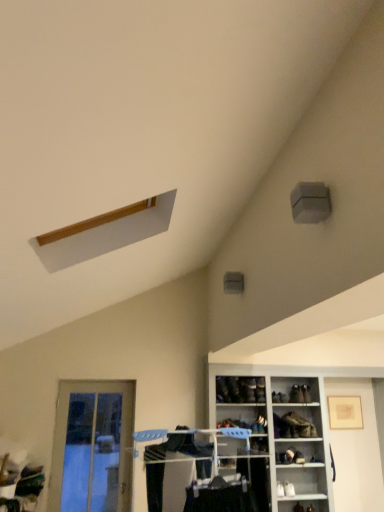
Describe the element at coordinates (249, 389) in the screenshot. I see `leather shoe at center, the 3th shoe from the right` at that location.

Measure the distance between point (300, 445) and camera.

Point (300, 445) is 5.01 meters from camera.

This screenshot has height=512, width=384. I want to click on white glossy shoe rack at lower right, the second shelf positioned from the left, so click(x=278, y=434).

This screenshot has height=512, width=384. I want to click on matte black shoe at lower center, arranged as the second shelf when viewed from the right, so click(293, 426).

Measure the distance between point (59, 412) and camera.

They are 15.10 feet apart.

At what (x,y) coordinates should I click in order to perform the action: click on leather shoe at center, acting as the second shoe starting from the right. Please return your answer as a coordinate pair (x, y). The width and height of the screenshot is (384, 512). Looking at the image, I should click on (260, 390).

From the image's perspective, is leather shoe at lower center, which is the 1th shoe from right to left, located above matte black shoe at lower center, positioned as the 1th shelf in left-to-right order?

Yes, from the image's perspective, leather shoe at lower center, which is the 1th shoe from right to left, is on top of matte black shoe at lower center, positioned as the 1th shelf in left-to-right order.

Is leather shoe at lower center, which is the 1th shoe from right to left, facing away from matte black shoe at lower center, positioned as the 1th shelf in left-to-right order?

leather shoe at lower center, which is the 1th shoe from right to left, is not turned away from matte black shoe at lower center, positioned as the 1th shelf in left-to-right order.

Is leather shoe at lower center, which is the 1th shoe from right to left, shorter than matte black shoe at lower center, positioned as the 1th shelf in left-to-right order?

Correct, leather shoe at lower center, which is the 1th shoe from right to left, is not as tall as matte black shoe at lower center, positioned as the 1th shelf in left-to-right order.

Can you confirm if leather shoe at lower center, the fourth shoe from the left, is smaller than matte black shoe at lower center, arranged as the second shelf when viewed from the right?

Indeed, leather shoe at lower center, the fourth shoe from the left, has a smaller size compared to matte black shoe at lower center, arranged as the second shelf when viewed from the right.

Looking at this image, is leather shoe at lower center, which is the 1th shoe from right to left, turned away from leather shoe at center, acting as the second shoe starting from the right?

No, leather shoe at lower center, which is the 1th shoe from right to left,'s orientation is not away from leather shoe at center, acting as the second shoe starting from the right.

From a real-world perspective, who is located higher, leather shoe at lower center, which is the 1th shoe from right to left, or leather shoe at center, acting as the second shoe starting from the right?

leather shoe at center, acting as the second shoe starting from the right.

Is leather shoe at lower center, the fourth shoe from the left, inside or outside of leather shoe at center, which is counted as the 3th shoe, starting from the left?

leather shoe at lower center, the fourth shoe from the left, lies outside leather shoe at center, which is counted as the 3th shoe, starting from the left.

How much distance is there between leather shoe at lower center, which is the 1th shoe from right to left, and leather shoe at center, which is counted as the 3th shoe, starting from the left?

They are 30.85 inches apart.

Are matte plastic clothes rack at lower center and leather shoe at lower center, the fourth shoe from the left, located far from each other?

Yes, matte plastic clothes rack at lower center and leather shoe at lower center, the fourth shoe from the left, are located far from each other.

In the image, there is a leather shoe at lower center, the fourth shoe from the left. Where is `closet below it (from a real-world perspective)`? closet below it (from a real-world perspective) is located at coordinates (204, 471).

From the image's perspective, relative to leather shoe at lower center, the fourth shoe from the left, is matte plastic clothes rack at lower center above or below?

From the image's perspective, matte plastic clothes rack at lower center appears above leather shoe at lower center, the fourth shoe from the left.

Is matte plastic clothes rack at lower center wider or thinner than leather shoe at lower center, the fourth shoe from the left?

Considering their sizes, matte plastic clothes rack at lower center looks broader than leather shoe at lower center, the fourth shoe from the left.

From the image's perspective, relative to matte plastic clothes rack at lower center, is matte black shoe at lower center, positioned as the 1th shelf in left-to-right order, above or below?

matte black shoe at lower center, positioned as the 1th shelf in left-to-right order, is below matte plastic clothes rack at lower center.

Can you confirm if matte black shoe at lower center, arranged as the second shelf when viewed from the right, is positioned to the right of matte plastic clothes rack at lower center?

Yes.

Is matte black shoe at lower center, positioned as the 1th shelf in left-to-right order, looking in the opposite direction of matte plastic clothes rack at lower center?

No, matte plastic clothes rack at lower center is not at the back of matte black shoe at lower center, positioned as the 1th shelf in left-to-right order.

Considering the relative sizes of white glossy shoe rack at lower right, the 1th shelf when ordered from right to left, and leather shoe at lower center, the fourth shoe from the left, in the image provided, is white glossy shoe rack at lower right, the 1th shelf when ordered from right to left, bigger than leather shoe at lower center, the fourth shoe from the left,?

Indeed, white glossy shoe rack at lower right, the 1th shelf when ordered from right to left, has a larger size compared to leather shoe at lower center, the fourth shoe from the left.

From the picture: Could you tell me if white glossy shoe rack at lower right, the second shelf positioned from the left, is facing leather shoe at lower center, which is the 1th shoe from right to left?

Yes.

From the image's perspective, is white glossy shoe rack at lower right, the 1th shelf when ordered from right to left, located above or below leather shoe at lower center, which is the 1th shoe from right to left?

white glossy shoe rack at lower right, the 1th shelf when ordered from right to left, is below leather shoe at lower center, which is the 1th shoe from right to left.

Which object is closer to the camera, leather shoe at center, acting as the second shoe starting from the right, or matte black shoe at lower center, positioned as the 1th shelf in left-to-right order?

matte black shoe at lower center, positioned as the 1th shelf in left-to-right order, is in front.

Which of these two, leather shoe at center, acting as the second shoe starting from the right, or matte black shoe at lower center, positioned as the 1th shelf in left-to-right order, stands shorter?

With less height is matte black shoe at lower center, positioned as the 1th shelf in left-to-right order.

How different are the orientations of leather shoe at center, which is counted as the 3th shoe, starting from the left, and matte black shoe at lower center, arranged as the second shelf when viewed from the right, in degrees?

6.28 degrees separate the facing orientations of leather shoe at center, which is counted as the 3th shoe, starting from the left, and matte black shoe at lower center, arranged as the second shelf when viewed from the right.

Is leather shoe at center, which is counted as the 3th shoe, starting from the left, smaller than matte black shoe at lower center, positioned as the 1th shelf in left-to-right order?

Correct, leather shoe at center, which is counted as the 3th shoe, starting from the left, occupies less space than matte black shoe at lower center, positioned as the 1th shelf in left-to-right order.

From the image's perspective, which is below, dark brown leather shoe at lower center, the 1th shoe from the left, or white glossy shoe rack at lower right, the second shelf positioned from the left?

white glossy shoe rack at lower right, the second shelf positioned from the left, appears lower in the image.

Between point (238, 400) and point (216, 404), which one is positioned behind?

The point (216, 404) is behind.

Which object is wider, dark brown leather shoe at lower center, the 1th shoe from the left, or white glossy shoe rack at lower right, the 1th shelf when ordered from right to left?

white glossy shoe rack at lower right, the 1th shelf when ordered from right to left, is wider.

Could you tell me if dark brown leather shoe at lower center, the 1th shoe from the left, is facing white glossy shoe rack at lower right, the 1th shelf when ordered from right to left?

Yes, dark brown leather shoe at lower center, the 1th shoe from the left, is aimed at white glossy shoe rack at lower right, the 1th shelf when ordered from right to left.

Which shoe is the 2nd one when counting from the back of the matte black shoe at lower center, arranged as the second shelf when viewed from the right? Please provide its 2D coordinates.

[(296, 394)]

The image size is (384, 512). In order to click on the 1st shoe in front of the leather shoe at lower center, the fourth shoe from the left in this screenshot , I will do `click(260, 390)`.

Considering their positions, is leather shoe at center, acting as the second shoe starting from the right, positioned closer to clear glass door at lower left than matte plastic clothes rack at lower center?

leather shoe at center, acting as the second shoe starting from the right.

Based on their spatial positions, is dark brown leather shoe at lower center, the 4th shoe from the right, or clear glass door at lower left further from leather shoe at center, the 3th shoe from the right?

The object further to leather shoe at center, the 3th shoe from the right, is clear glass door at lower left.

Looking at the image, which one is located further to clear glass door at lower left, leather shoe at center, which is counted as the 3th shoe, starting from the left, or leather shoe at center, which appears as the second shoe when viewed from the left?

leather shoe at center, which is counted as the 3th shoe, starting from the left, lies further to clear glass door at lower left than the other object.

Considering their positions, is matte plastic clothes rack at lower center positioned closer to dark brown leather shoe at lower center, the 4th shoe from the right, than leather shoe at lower center, which is the 1th shoe from right to left?

leather shoe at lower center, which is the 1th shoe from right to left, lies closer to dark brown leather shoe at lower center, the 4th shoe from the right, than the other object.

From the picture: Considering their positions, is white glossy shoe rack at lower right, the second shelf positioned from the left, positioned further to dark brown leather shoe at lower center, the 4th shoe from the right, than leather shoe at lower center, the fourth shoe from the left?

leather shoe at lower center, the fourth shoe from the left.

Looking at the image, which one is located further to white glossy shoe rack at lower right, the 1th shelf when ordered from right to left, dark brown leather shoe at lower center, the 1th shoe from the left, or matte plastic clothes rack at lower center?

Among the two, matte plastic clothes rack at lower center is located further to white glossy shoe rack at lower right, the 1th shelf when ordered from right to left.

Which object lies further to the anchor point white glossy shoe rack at lower right, the 1th shelf when ordered from right to left, clear glass door at lower left or dark brown leather shoe at lower center, the 1th shoe from the left?

clear glass door at lower left lies further to white glossy shoe rack at lower right, the 1th shelf when ordered from right to left, than the other object.

Estimate the real-world distances between objects in this image. Which object is further from dark brown leather shoe at lower center, the 4th shoe from the right, clear glass door at lower left or leather shoe at center, acting as the second shoe starting from the right?

clear glass door at lower left is further to dark brown leather shoe at lower center, the 4th shoe from the right.

You are a GUI agent. You are given a task and a screenshot of the screen. Output one action in this format:
    pyautogui.click(x=<x>, y=<y>)
    Task: Click on the shoe between matte plastic clothes rack at lower center and leather shoe at center, which appears as the second shoe when viewed from the left, along the z-axis
    The image size is (384, 512).
    Given the screenshot: What is the action you would take?
    pyautogui.click(x=234, y=389)

In order to click on shelf between matte plastic clothes rack at lower center and matte black shoe at lower center, positioned as the 1th shelf in left-to-right order, along the z-axis in this screenshot , I will do `click(278, 434)`.

At what (x,y) coordinates should I click in order to perform the action: click on door between matte plastic clothes rack at lower center and leather shoe at center, which appears as the second shoe when viewed from the left, along the z-axis. Please return your answer as a coordinate pair (x, y). Image resolution: width=384 pixels, height=512 pixels. Looking at the image, I should click on (92, 447).

The width and height of the screenshot is (384, 512). In order to click on door between matte plastic clothes rack at lower center and matte black shoe at lower center, arranged as the second shelf when viewed from the right, from front to back in this screenshot , I will do `click(92, 447)`.